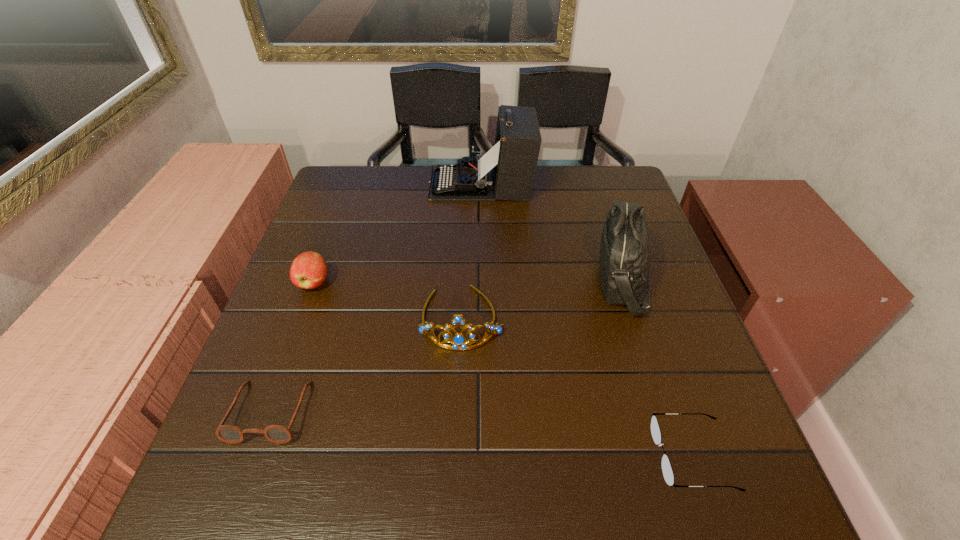
You are a GUI agent. You are given a task and a screenshot of the screen. Output one action in this format:
    pyautogui.click(x=<x>, y=<y>)
    Task: Click on the object positioned at the near edge
    This screenshot has height=540, width=960.
    Given the screenshot: What is the action you would take?
    pyautogui.click(x=667, y=471)

Locate an element on the screen. This screenshot has width=960, height=540. apple located in the left edge section of the desktop is located at coordinates (308, 270).

Where is `spectacles that is at the left edge`? The height and width of the screenshot is (540, 960). spectacles that is at the left edge is located at coordinates (279, 434).

You are a GUI agent. You are given a task and a screenshot of the screen. Output one action in this format:
    pyautogui.click(x=<x>, y=<y>)
    Task: Click on the shoulder bag present at the right edge
    Image resolution: width=960 pixels, height=540 pixels.
    Given the screenshot: What is the action you would take?
    pyautogui.click(x=625, y=245)

Image resolution: width=960 pixels, height=540 pixels. Identify the location of spectacles located in the right edge section of the desktop. (667, 471).

At what (x,y) coordinates should I click in order to perform the action: click on object that is at the near right corner. Please return your answer as a coordinate pair (x, y). This screenshot has height=540, width=960. Looking at the image, I should click on (667, 471).

In the image, there is a desktop. Where is `vacant region at the far edge`? This screenshot has height=540, width=960. vacant region at the far edge is located at coordinates (427, 178).

The height and width of the screenshot is (540, 960). In the image, there is a desktop. In order to click on free space at the near edge in this screenshot , I will do `click(471, 477)`.

This screenshot has width=960, height=540. In order to click on free point at the left edge in this screenshot , I will do `click(233, 417)`.

Where is `vacant point at the right edge`? vacant point at the right edge is located at coordinates (709, 411).